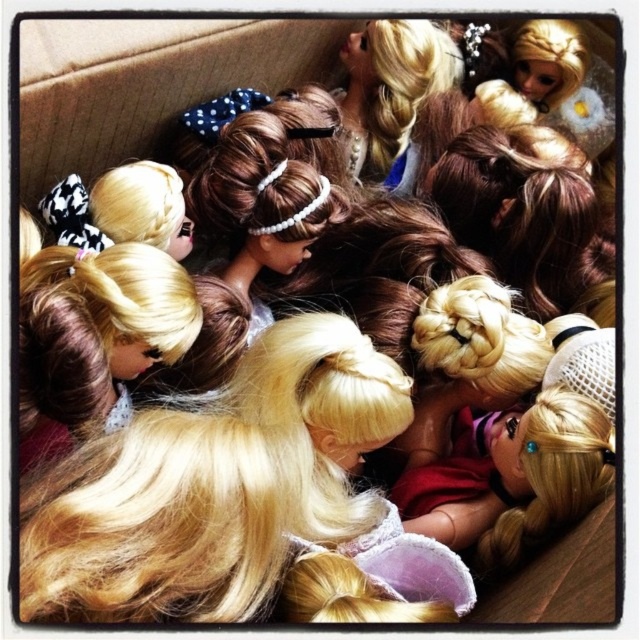
You are organizing a doll collection and need to determine the visibility of the blonde silky hair at center. Since there are two dolls with blonde hair at center, which one is more visible?

The blonde hair at center is in front of blonde silky hair at center, so the blonde hair at center is more visible.

You are a doll collector organizing a display. You have two dolls with blonde hair at center and blonde silky hair at center. You want to place them side by side on a shelf that is 12 inches wide. Will they fit together without overlapping?

The distance between blonde hair at center and blonde silky hair at center is 11.04 inches. Since the shelf is 12 inches wide, they can be placed side by side with some space between them.